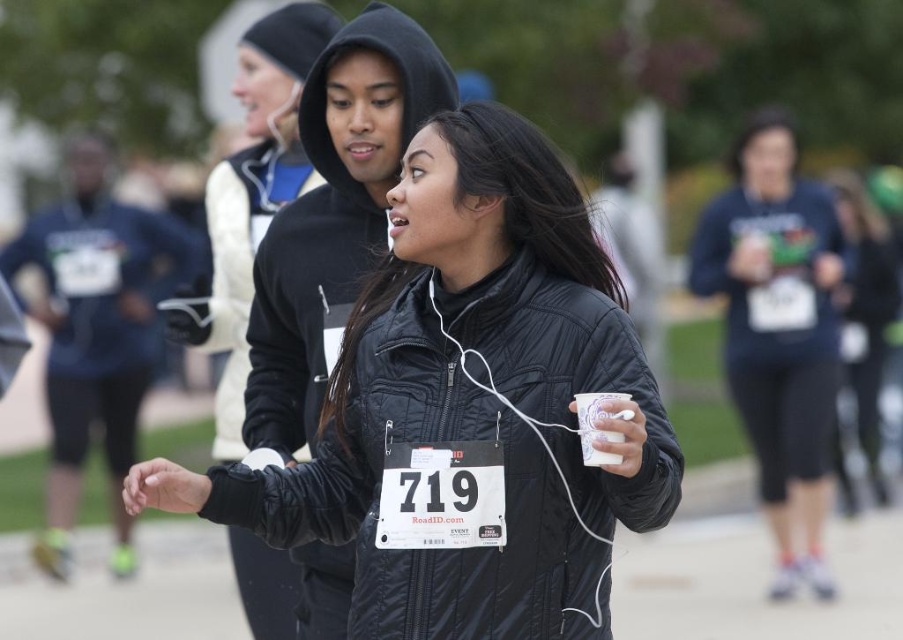
You are a photographer at the running event. You want to take a photo that includes both the matte blue sweatshirt at center and the white paper cup at center. Which object should you focus on first to ensure both are in frame?

The matte blue sweatshirt at center is larger in size than the white paper cup at center, so you should focus on the matte blue sweatshirt at center first to ensure both are in frame.

You are organizing a charity run and need to ensure participants have enough space to carry their items. If a participant is wearing the black quilted jacket at center and holding the white paper cup at center, which item takes up more horizontal space?

The black quilted jacket at center has a larger width than the white paper cup at center, so the jacket takes up more horizontal space.